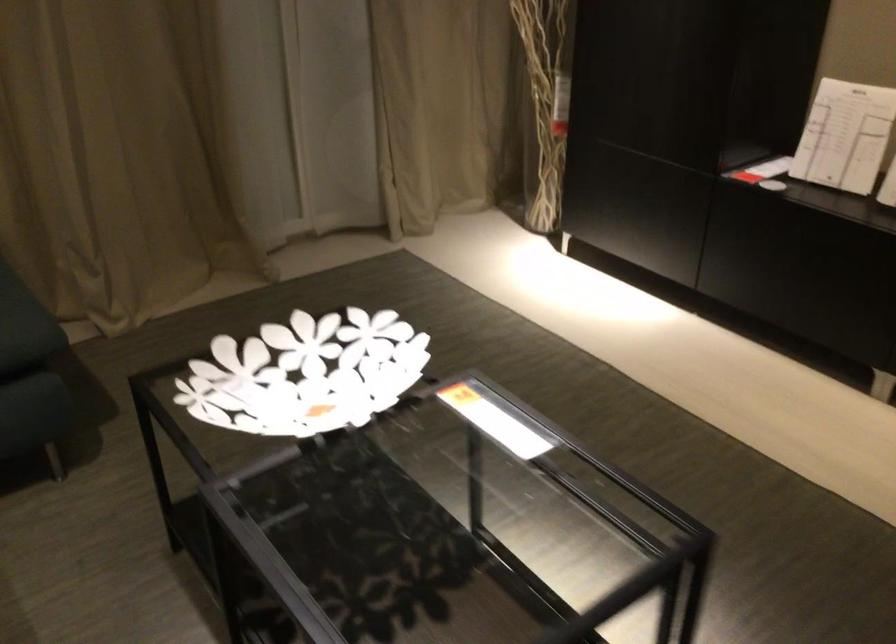
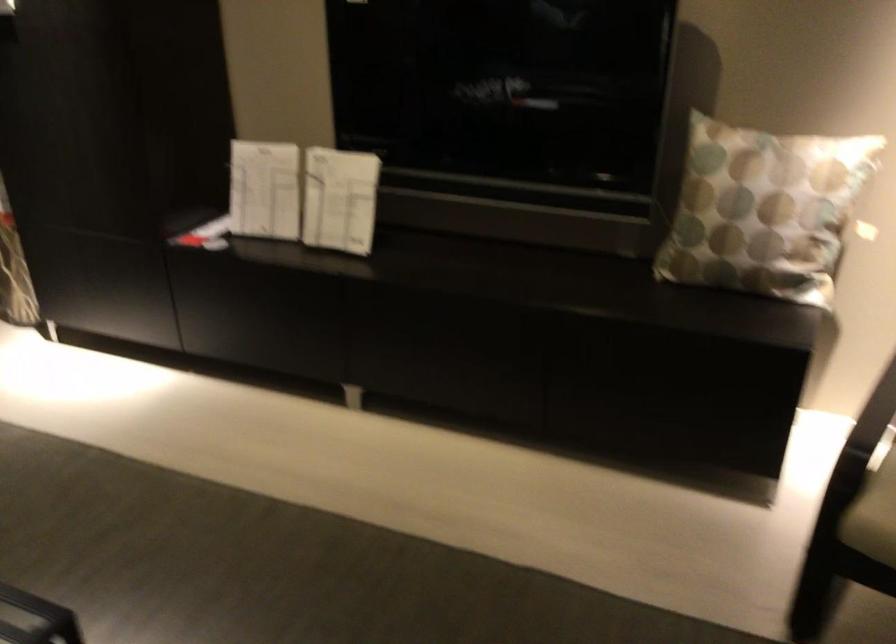
Question: The camera is either moving clockwise (left) or counter-clockwise (right) around the object. The first image is from the beginning of the video and the second image is from the end. Is the camera moving left or right when shooting the video?

Choices:
 (A) Left
 (B) Right

Answer: (A)